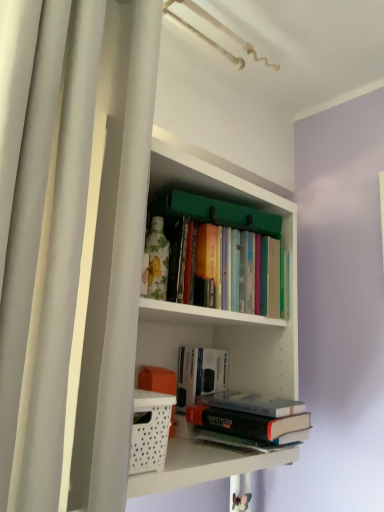
Find the location of `blank space above hardcover book at center, the first book ordered from the bottom (from a real-world perspective)`. blank space above hardcover book at center, the first book ordered from the bottom (from a real-world perspective) is located at coordinates (250, 400).